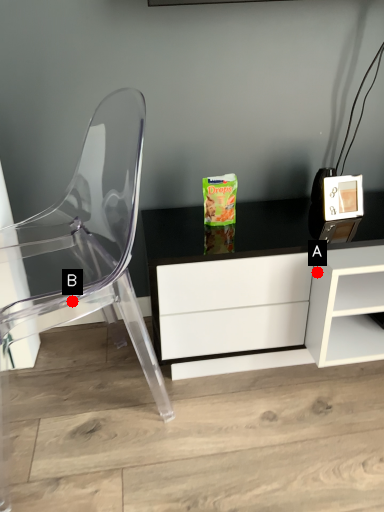
Question: Two points are circled on the image, labeled by A and B beside each circle. Which point is farther from the camera taking this photo?

Choices:
 (A) A is further
 (B) B is further

Answer: (B)